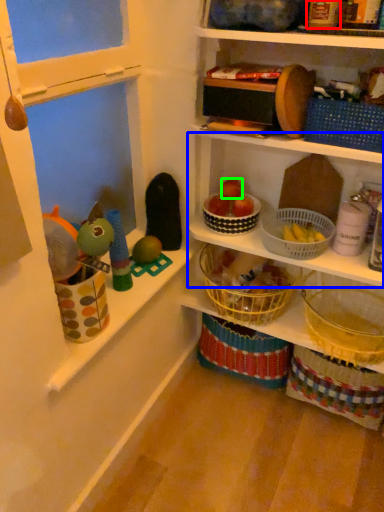
Question: Considering the real-world distances, which object is farthest from toy (highlighted by a red box)? shelf (highlighted by a blue box) or apple (highlighted by a green box)?

Choices:
 (A) shelf
 (B) apple

Answer: (B)